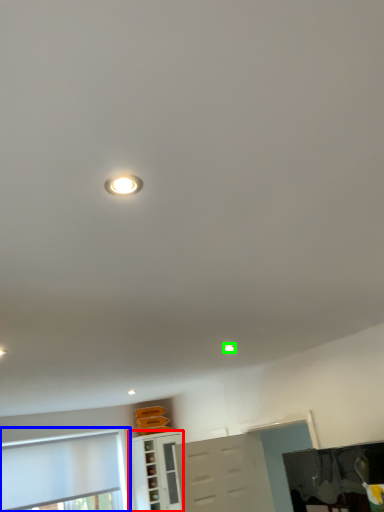
Question: Which object is positioned farthest from cabinetry (highlighted by a red box)? Select from window (highlighted by a blue box) and droplight (highlighted by a green box).

Choices:
 (A) window
 (B) droplight

Answer: (B)